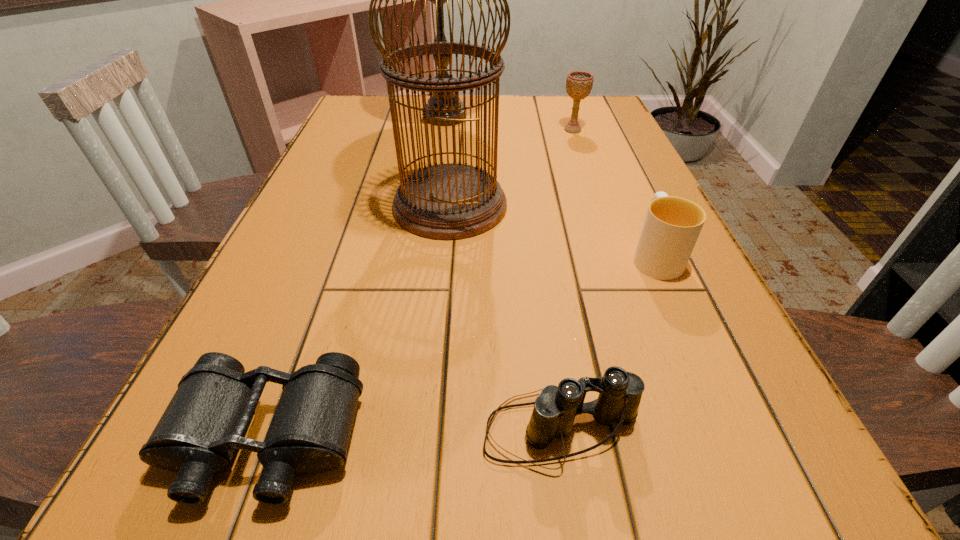
Find the location of a particular element. The height and width of the screenshot is (540, 960). vacant space located on the left of the third tallest object is located at coordinates (451, 130).

In order to click on vacant space located 0.360m with the handle on the side of the third shortest object in this screenshot , I will do click(607, 147).

Locate an element on the screen. The height and width of the screenshot is (540, 960). vacant space located 0.210m with the handle on the side of the third shortest object is located at coordinates (620, 178).

The image size is (960, 540). I want to click on vacant area situated with the handle on the side of the third shortest object, so click(638, 218).

Find the location of a particular element. vacant space situated 0.390m on the left of the taller binoculars is located at coordinates (180, 430).

The width and height of the screenshot is (960, 540). In order to click on lamp that is positioned at the far edge in this screenshot , I will do `click(440, 26)`.

I want to click on chalice at the far edge, so click(578, 83).

I want to click on object positioned at the near edge, so pyautogui.click(x=206, y=420).

Locate an element on the screen. The width and height of the screenshot is (960, 540). lamp at the left edge is located at coordinates (440, 26).

Where is `binoculars present at the left edge`? The height and width of the screenshot is (540, 960). binoculars present at the left edge is located at coordinates (206, 420).